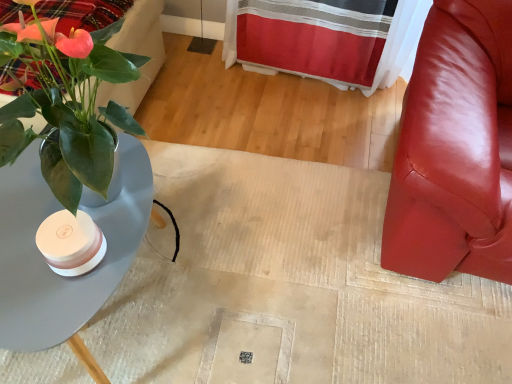
Question: Could you tell me if matte white vase at left is turned towards matte gray table at left?

Choices:
 (A) no
 (B) yes

Answer: (A)

Question: Is matte white vase at left oriented away from matte gray table at left?

Choices:
 (A) no
 (B) yes

Answer: (A)

Question: Is matte white vase at left in front of matte gray table at left?

Choices:
 (A) no
 (B) yes

Answer: (A)

Question: Considering the relative positions of matte white vase at left and matte gray table at left in the image provided, is matte white vase at left to the right of matte gray table at left from the viewer's perspective?

Choices:
 (A) no
 (B) yes

Answer: (B)

Question: From a real-world perspective, is matte white vase at left physically below matte gray table at left?

Choices:
 (A) yes
 (B) no

Answer: (A)

Question: Would you consider matte white vase at left to be distant from matte gray table at left?

Choices:
 (A) no
 (B) yes

Answer: (A)

Question: From a real-world perspective, does velvet plaid bedding at upper left stand above glossy leather chair at right?

Choices:
 (A) no
 (B) yes

Answer: (B)

Question: Can you confirm if velvet plaid bedding at upper left is shorter than glossy leather chair at right?

Choices:
 (A) yes
 (B) no

Answer: (A)

Question: Does velvet plaid bedding at upper left appear on the right side of glossy leather chair at right?

Choices:
 (A) yes
 (B) no

Answer: (B)

Question: Can you confirm if velvet plaid bedding at upper left is taller than glossy leather chair at right?

Choices:
 (A) no
 (B) yes

Answer: (A)

Question: Is there a large distance between velvet plaid bedding at upper left and glossy leather chair at right?

Choices:
 (A) yes
 (B) no

Answer: (B)

Question: From the image's perspective, is velvet plaid bedding at upper left under glossy leather chair at right?

Choices:
 (A) yes
 (B) no

Answer: (B)

Question: Considering the relative positions of green glossy plant at left and glossy leather chair at right in the image provided, is green glossy plant at left in front of glossy leather chair at right?

Choices:
 (A) no
 (B) yes

Answer: (A)